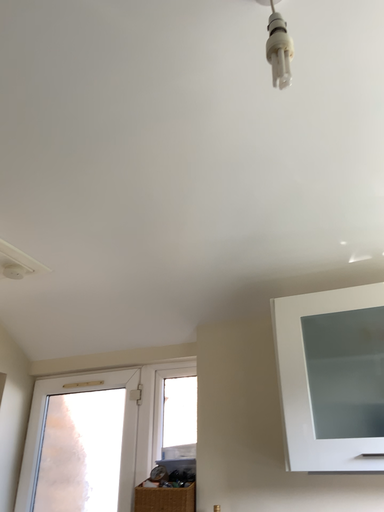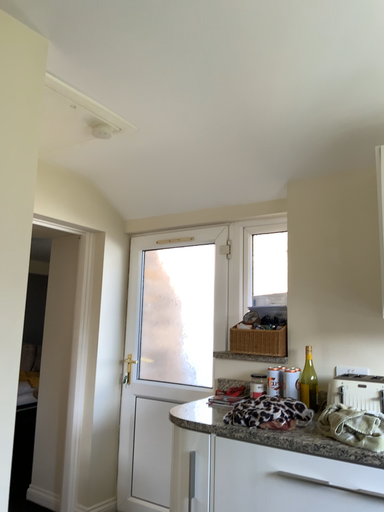
Question: How did the camera likely rotate when shooting the video?

Choices:
 (A) rotated upward
 (B) rotated downward

Answer: (B)